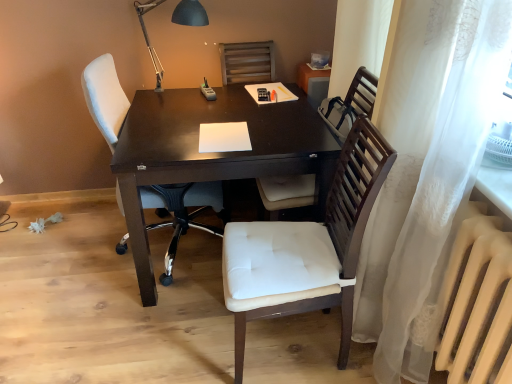
I want to click on free space to the left of white fabric chair at center, which is the second chair in left-to-right order, so click(186, 343).